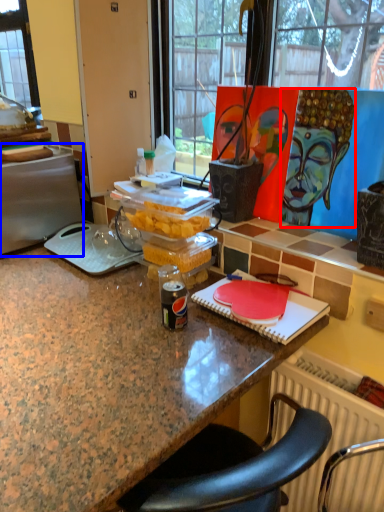
Question: Which of the following is the closest to the observer, person (highlighted by a red box) or appliance (highlighted by a blue box)?

Choices:
 (A) person
 (B) appliance

Answer: (A)